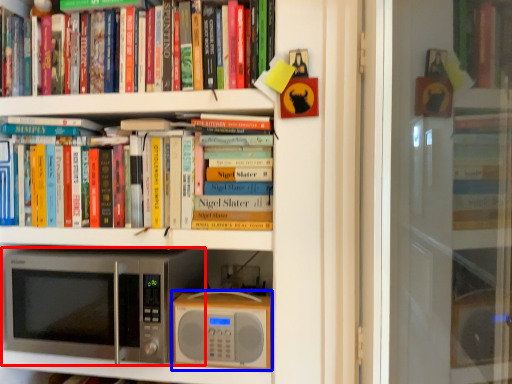
Question: Which point is further to the camera, microwave oven (highlighted by a red box) or appliance (highlighted by a blue box)?

Choices:
 (A) microwave oven
 (B) appliance

Answer: (B)